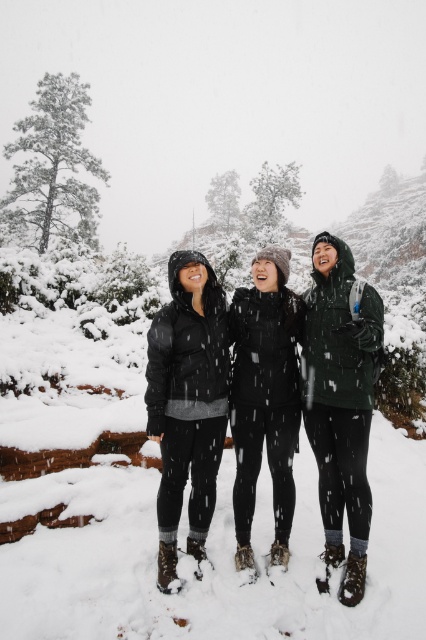
Question: Does matte black jacket at center have a greater width compared to black fleece jacket at center?

Choices:
 (A) yes
 (B) no

Answer: (A)

Question: Can you confirm if matte black jacket at center is positioned to the right of black fleece jacket at center?

Choices:
 (A) yes
 (B) no

Answer: (B)

Question: Is matte black jacket at center to the right of black fleece jacket at center from the viewer's perspective?

Choices:
 (A) no
 (B) yes

Answer: (A)

Question: Which object appears farthest from the camera in this image?

Choices:
 (A) matte black jacket at center
 (B) black fleece jacket at center

Answer: (B)

Question: Which of the following is the farthest from the observer?

Choices:
 (A) matte black jacket at center
 (B) black fleece jacket at center

Answer: (B)

Question: Which point is closer to the camera taking this photo?

Choices:
 (A) (252, 348)
 (B) (178, 513)

Answer: (B)